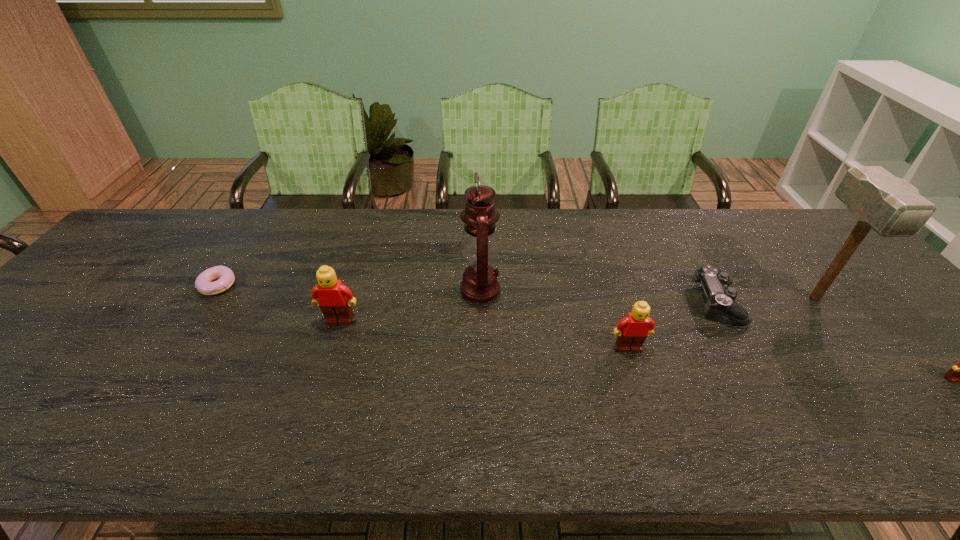
This screenshot has width=960, height=540. In order to click on object that is the fourth closest to the leftmost object in this screenshot , I will do `click(721, 299)`.

Identify the location of the closest Lego to the oil lamp. The height and width of the screenshot is (540, 960). (334, 299).

This screenshot has width=960, height=540. Find the location of `the closest Lego to the sixth farthest object`. the closest Lego to the sixth farthest object is located at coordinates tap(334, 299).